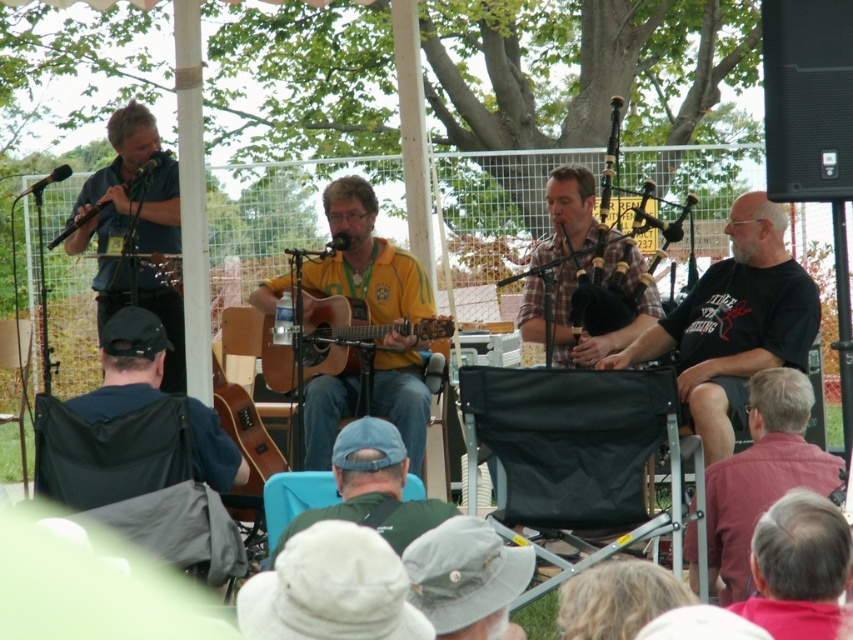
Consider the image. Is acoustic wood guitar at center thinner than wooden acoustic guitar at center?

Incorrect, acoustic wood guitar at center's width is not less than wooden acoustic guitar at center's.

Between point (363, 324) and point (244, 458), which one is positioned in front?

Point (244, 458) is more forward.

Between point (318, 307) and point (223, 394), which one is positioned behind?

Point (223, 394)

Identify the location of acoustic wood guitar at center. This screenshot has height=640, width=853. (352, 333).

Between yellow-green jersey at center and matte black microphone at left, which one is positioned higher?

matte black microphone at left

Is yellow-green jersey at center thinner than matte black microphone at left?

Incorrect, yellow-green jersey at center's width is not less than matte black microphone at left's.

Between point (380, 349) and point (114, 193), which one is positioned behind?

Positioned behind is point (114, 193).

Locate an element on the screen. The image size is (853, 640). yellow-green jersey at center is located at coordinates point(367,259).

Does matte black microphone at left have a greater width compared to plaid fabric bagpipes at center?

Indeed, matte black microphone at left has a greater width compared to plaid fabric bagpipes at center.

Between matte black microphone at left and plaid fabric bagpipes at center, which one is positioned higher?

matte black microphone at left is higher up.

Between point (123, 180) and point (614, 256), which one is positioned in front?

Positioned in front is point (614, 256).

Where is `matte black microphone at left`? This screenshot has width=853, height=640. matte black microphone at left is located at coordinates (x=114, y=179).